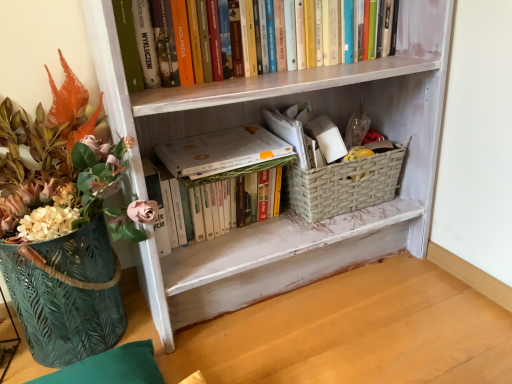
I want to click on free space between green textured basket at left and white painted wood bookcase at center, so click(278, 321).